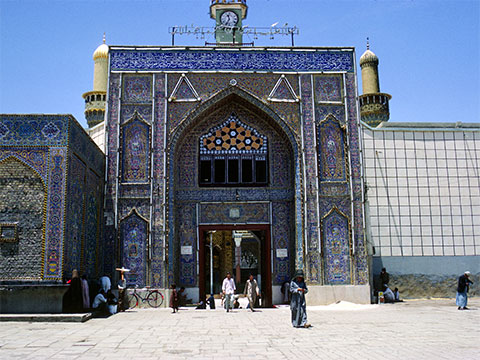
Where is `clock`? This screenshot has width=480, height=360. clock is located at coordinates (231, 17).